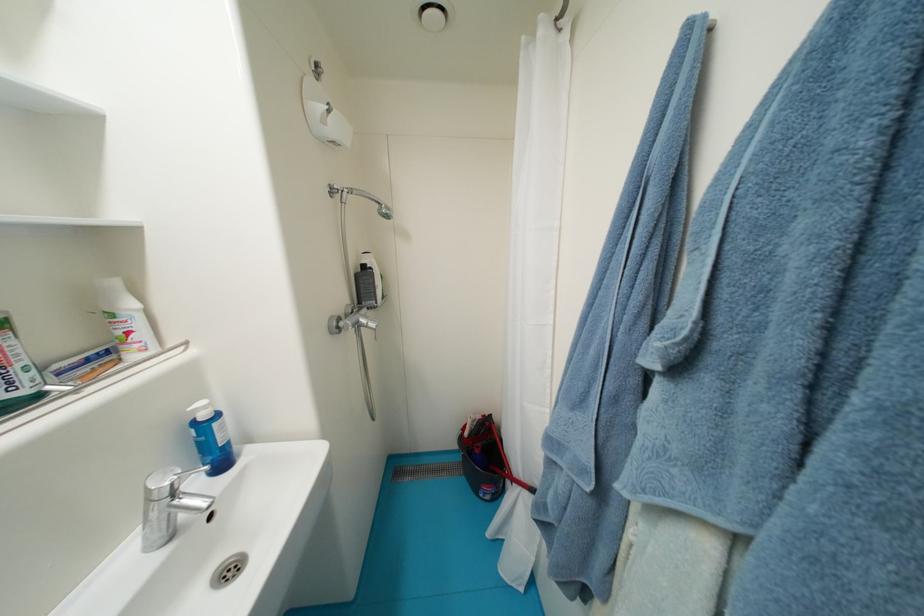
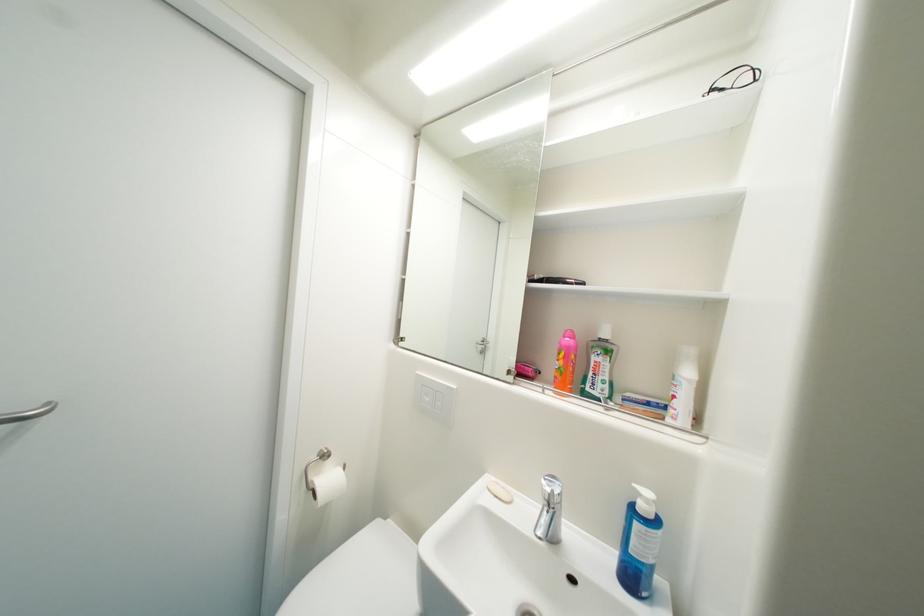
Question: I am providing you with two images of the same scene from different viewpoints. Please identify which objects are invisible in image2.

Choices:
 (A) toilet paper roll
 (B) silver door handle
 (C) blue soap bottle
 (D) none of these

Answer: (D)